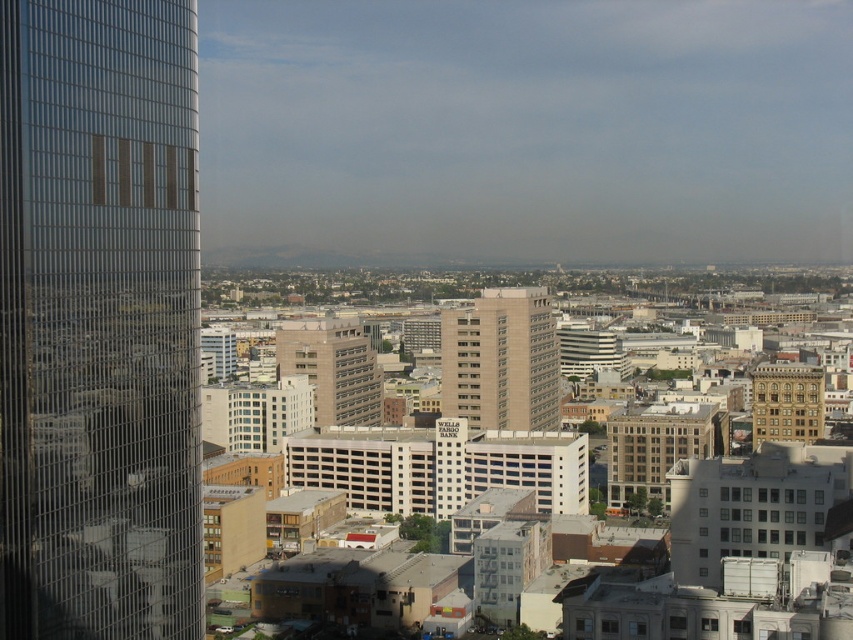
Question: Is beige concrete building at center wider than matte beige building at center?

Choices:
 (A) no
 (B) yes

Answer: (A)

Question: Which object is positioned closest to the beige stone building at center?

Choices:
 (A) brown brick building at right
 (B) matte beige building at center
 (C) glassy reflective skyscraper at left

Answer: (A)

Question: Is beige stone building at center below matte beige building at center?

Choices:
 (A) no
 (B) yes

Answer: (B)

Question: Does glassy reflective skyscraper at left have a greater width compared to brown brick building at right?

Choices:
 (A) no
 (B) yes

Answer: (B)

Question: Considering the real-world distances, which object is closest to the glassy reflective skyscraper at left?

Choices:
 (A) brown brick building at right
 (B) beige stone building at center
 (C) beige concrete building at center
 (D) matte beige building at center

Answer: (C)

Question: Considering the real-world distances, which object is closest to the brown brick building at right?

Choices:
 (A) glassy reflective skyscraper at left
 (B) beige concrete building at center
 (C) matte beige building at center
 (D) beige stone building at center

Answer: (D)